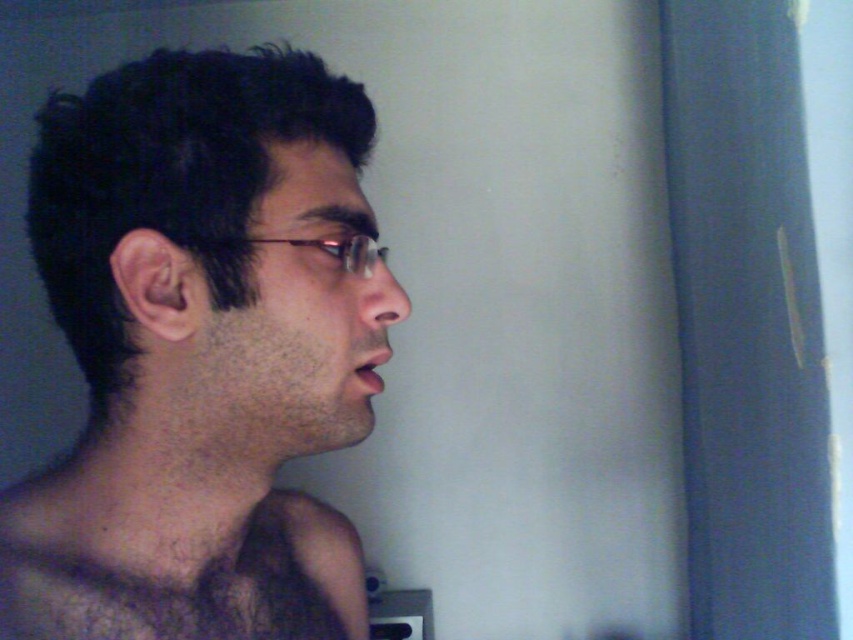
Question: Which point is farther from the camera taking this photo?

Choices:
 (A) [257, 572]
 (B) [167, 125]

Answer: (A)

Question: Can you confirm if dark brown hair at upper left is positioned above dark brown hairy muscle at center?

Choices:
 (A) yes
 (B) no

Answer: (A)

Question: Which point is farther to the camera?

Choices:
 (A) (361, 572)
 (B) (131, 566)

Answer: (A)

Question: Is dark brown hair at upper left to the right of dark brown hairy muscle at center from the viewer's perspective?

Choices:
 (A) yes
 (B) no

Answer: (B)

Question: Is dark brown hair at upper left smaller than dark brown hairy muscle at center?

Choices:
 (A) no
 (B) yes

Answer: (A)